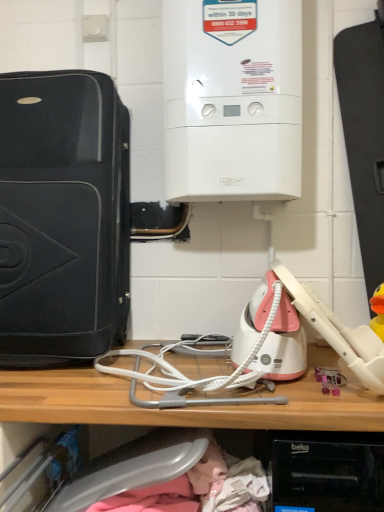
Where is `free location to the left of pink plastic toy at lower right`? free location to the left of pink plastic toy at lower right is located at coordinates (280, 387).